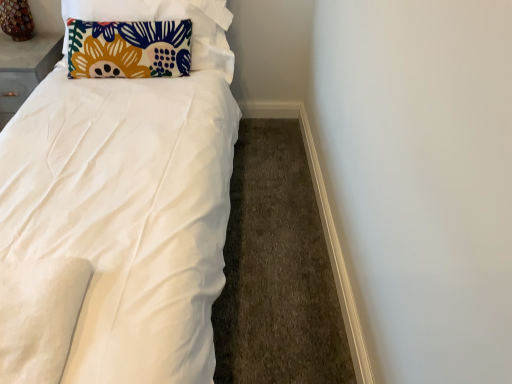
Question: Does point pos(58,49) appear closer or farther from the camera than point pos(356,365)?

Choices:
 (A) farther
 (B) closer

Answer: (A)

Question: From a real-world perspective, is matte gray table at upper left positioned above or below white smooth baseboard at lower right?

Choices:
 (A) above
 (B) below

Answer: (A)

Question: Considering the real-world distances, which object is farthest from the white smooth baseboard at lower right?

Choices:
 (A) matte gray table at upper left
 (B) floral fabric pillow at upper left
 (C) wooden table lamp at upper left

Answer: (C)

Question: Which of these objects is positioned farthest from the matte gray table at upper left?

Choices:
 (A) white smooth baseboard at lower right
 (B) wooden table lamp at upper left
 (C) floral fabric pillow at upper left

Answer: (A)